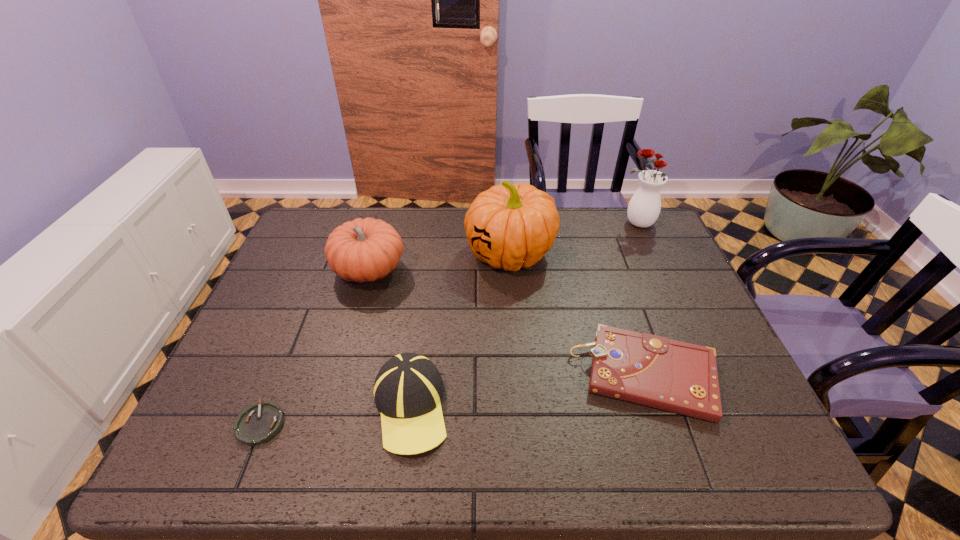
At what (x,y) coordinates should I click in order to perform the action: click on vacant region that satisfies the following two spatial constraints: 1. on the surface of the taller pumpkin; 2. with the brim of the fourth tallest object facing forward. Please return your answer as a coordinate pair (x, y). The width and height of the screenshot is (960, 540). Looking at the image, I should click on (522, 407).

Find the location of a particular element. The height and width of the screenshot is (540, 960). vacant space that satisfies the following two spatial constraints: 1. on the surface of the taller pumpkin; 2. with the brim of the baseball cap facing forward is located at coordinates (522, 407).

Identify the location of free point that satisfies the following two spatial constraints: 1. on the back side of the vase; 2. on the left side of the second shortest object. Image resolution: width=960 pixels, height=540 pixels. (595, 224).

At what (x,y) coordinates should I click in order to perform the action: click on free location that satisfies the following two spatial constraints: 1. on the back side of the ashtray; 2. on the right side of the vase. Please return your answer as a coordinate pair (x, y). The width and height of the screenshot is (960, 540). Looking at the image, I should click on pyautogui.click(x=341, y=224).

The image size is (960, 540). I want to click on vacant space that satisfies the following two spatial constraints: 1. on the back side of the ashtray; 2. on the left side of the vase, so click(341, 224).

I want to click on free spot that satisfies the following two spatial constraints: 1. on the back side of the shortest object; 2. on the left side of the third tallest object, so click(x=323, y=270).

At what (x,y) coordinates should I click in order to perform the action: click on free location that satisfies the following two spatial constraints: 1. on the surface of the right pumpkin; 2. on the left side of the fifth tallest object. Please return your answer as a coordinate pair (x, y). This screenshot has width=960, height=540. Looking at the image, I should click on (519, 375).

This screenshot has width=960, height=540. Identify the location of free spot that satisfies the following two spatial constraints: 1. on the back side of the shorter pumpkin; 2. on the left side of the ashtray. (323, 270).